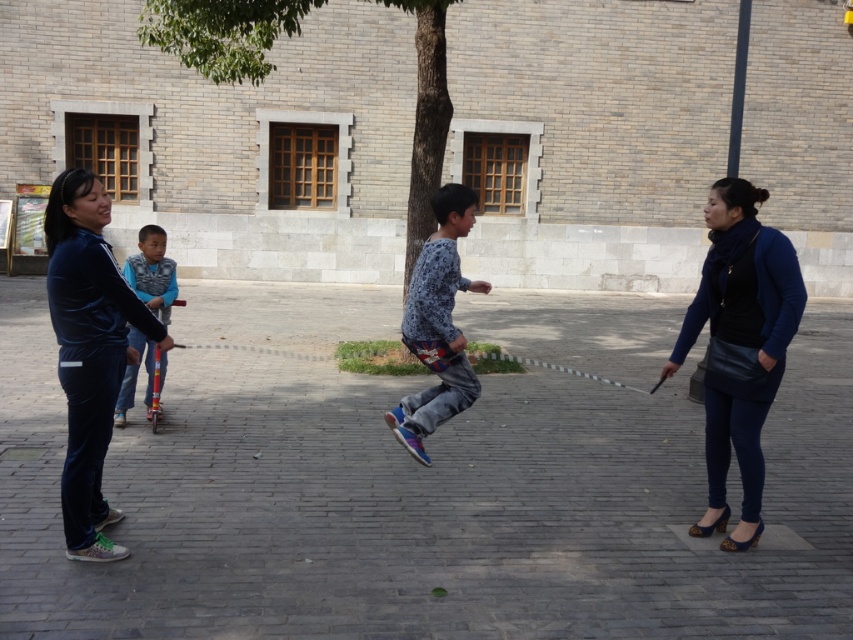
Is velvet blue tracksuit at left to the right of blue printed shirt at center from the viewer's perspective?

In fact, velvet blue tracksuit at left is to the left of blue printed shirt at center.

Can you confirm if velvet blue tracksuit at left is positioned to the left of blue printed shirt at center?

Yes, velvet blue tracksuit at left is to the left of blue printed shirt at center.

Who is more distant from viewer, (67, 186) or (428, 392)?

The point (428, 392) is more distant.

Image resolution: width=853 pixels, height=640 pixels. I want to click on velvet blue tracksuit at left, so click(90, 349).

Between blue leather jacket at lower right and velvet blue tracksuit at left, which one has less height?

velvet blue tracksuit at left is shorter.

Can you confirm if blue leather jacket at lower right is positioned below velvet blue tracksuit at left?

Indeed, blue leather jacket at lower right is positioned under velvet blue tracksuit at left.

Which is in front, point (780, 262) or point (64, 246)?

Positioned in front is point (64, 246).

This screenshot has width=853, height=640. What are the coordinates of `blue leather jacket at lower right` in the screenshot? It's located at coord(740,346).

Is blue leather jacket at lower right below blue printed shirt at center?

Yes, blue leather jacket at lower right is below blue printed shirt at center.

Is blue leather jacket at lower right above blue printed shirt at center?

Actually, blue leather jacket at lower right is below blue printed shirt at center.

At what (x,y) coordinates should I click in order to perform the action: click on blue leather jacket at lower right. Please return your answer as a coordinate pair (x, y). The height and width of the screenshot is (640, 853). Looking at the image, I should click on (740, 346).